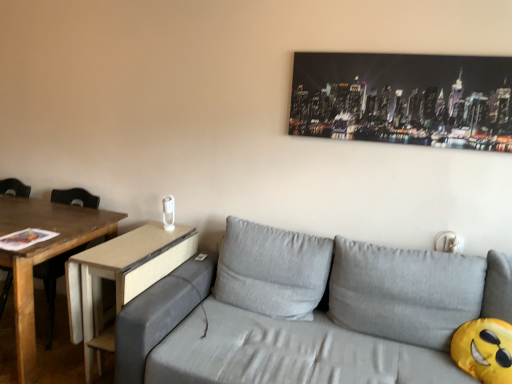
Image resolution: width=512 pixels, height=384 pixels. What do you see at coordinates (53, 283) in the screenshot?
I see `wooden chair at left` at bounding box center [53, 283].

What do you see at coordinates (308, 312) in the screenshot? I see `gray fabric couch at center` at bounding box center [308, 312].

This screenshot has width=512, height=384. What do you see at coordinates (120, 279) in the screenshot?
I see `light brown wood side table at center-left` at bounding box center [120, 279].

This screenshot has height=384, width=512. What do you see at coordinates (404, 99) in the screenshot?
I see `metallic cityscape print at upper right` at bounding box center [404, 99].

I want to click on wooden chair at left, so click(53, 283).

Between gray fabric couch at center and light brown wood side table at center-left, which one has less height?

light brown wood side table at center-left is shorter.

Considering the points (405, 272) and (130, 299), which point is in front, point (405, 272) or point (130, 299)?

Positioned in front is point (405, 272).

Considering the relative sizes of gray fabric couch at center and light brown wood side table at center-left in the image provided, is gray fabric couch at center smaller than light brown wood side table at center-left?

No, gray fabric couch at center is not smaller than light brown wood side table at center-left.

From the image's perspective, is wooden chair at left beneath light brown wood side table at center-left?

No.

Between wooden chair at left and light brown wood side table at center-left, which one has larger size?

With larger size is wooden chair at left.

Would you say wooden chair at left is outside light brown wood side table at center-left?

Yes, wooden chair at left is not within light brown wood side table at center-left.

Which is more to the right, wooden chair at left or light brown wood side table at center-left?

From the viewer's perspective, light brown wood side table at center-left appears more on the right side.

Which object is wider, metallic cityscape print at upper right or wooden chair at left?

wooden chair at left is wider.

Does point (340, 130) come farther from viewer compared to point (56, 192)?

That is False.

You are a GUI agent. You are given a task and a screenshot of the screen. Output one action in this format:
    pyautogui.click(x=<x>, y=<y>)
    Task: Click on the chair behind the metallic cityscape print at upper right
    
    Given the screenshot: What is the action you would take?
    pyautogui.click(x=53, y=283)

Would you say metallic cityscape print at upper right is to the left or to the right of wooden chair at left in the picture?

metallic cityscape print at upper right is positioned on wooden chair at left's right side.

Between light brown wood side table at center-left and wooden chair at left, which one appears on the left side from the viewer's perspective?

From the viewer's perspective, wooden chair at left appears more on the left side.

How far apart are light brown wood side table at center-left and wooden chair at left?

light brown wood side table at center-left and wooden chair at left are 16.36 inches apart.

Which is farther, (122, 241) or (75, 196)?

The point (75, 196) is farther from the camera.

From the image's perspective, who appears lower, light brown wood side table at center-left or wooden chair at left?

light brown wood side table at center-left.

This screenshot has width=512, height=384. Identify the location of picture frame that appears above the light brown wood side table at center-left (from the image's perspective). (404, 99).

Considering the sizes of objects metallic cityscape print at upper right and light brown wood side table at center-left in the image provided, who is taller, metallic cityscape print at upper right or light brown wood side table at center-left?

With more height is light brown wood side table at center-left.

Is metallic cityscape print at upper right spatially inside light brown wood side table at center-left, or outside of it?

metallic cityscape print at upper right lies outside light brown wood side table at center-left.

Considering the relative positions of metallic cityscape print at upper right and light brown wood side table at center-left in the image provided, is metallic cityscape print at upper right behind light brown wood side table at center-left?

That is True.

Are wooden chair at left and gray fabric couch at center located far from each other?

That's right, there is a large distance between wooden chair at left and gray fabric couch at center.

Is point (56, 257) farther from viewer compared to point (200, 366)?

Yes, it is.

How different are the orientations of wooden chair at left and gray fabric couch at center in degrees?

wooden chair at left and gray fabric couch at center are facing 2.31 degrees away from each other.

Does wooden chair at left have a larger size compared to gray fabric couch at center?

Actually, wooden chair at left might be smaller than gray fabric couch at center.

Is wooden chair at left not close to metallic cityscape print at upper right?

wooden chair at left is positioned a significant distance from metallic cityscape print at upper right.

Considering the sizes of objects wooden chair at left and metallic cityscape print at upper right in the image provided, who is wider, wooden chair at left or metallic cityscape print at upper right?

wooden chair at left.

Is point (5, 281) in front of point (445, 103)?

No, (5, 281) is further to viewer.

Can you tell me how much wooden chair at left and metallic cityscape print at upper right differ in facing direction?

There is a 1.16-degree angle between the facing directions of wooden chair at left and metallic cityscape print at upper right.

Locate an element on the screen. Image resolution: width=512 pixels, height=384 pixels. studio couch above the light brown wood side table at center-left (from a real-world perspective) is located at coordinates (308, 312).

Locate an element on the screen. The width and height of the screenshot is (512, 384). chair on the left of light brown wood side table at center-left is located at coordinates (53, 283).

Which object lies nearer to the anchor point wooden chair at left, metallic cityscape print at upper right or gray fabric couch at center?

gray fabric couch at center.

When comparing their distances from gray fabric couch at center, does light brown wood side table at center-left or wooden chair at left seem closer?

light brown wood side table at center-left is positioned closer to the anchor gray fabric couch at center.

When comparing their distances from gray fabric couch at center, does wooden chair at left or metallic cityscape print at upper right seem closer?

Among the two, metallic cityscape print at upper right is located nearer to gray fabric couch at center.

When comparing their distances from metallic cityscape print at upper right, does gray fabric couch at center or wooden chair at left seem closer?

gray fabric couch at center is closer to metallic cityscape print at upper right.

Looking at the image, which one is located closer to gray fabric couch at center, metallic cityscape print at upper right or wooden chair at left?

Based on the image, metallic cityscape print at upper right appears to be nearer to gray fabric couch at center.

Based on their spatial positions, is metallic cityscape print at upper right or light brown wood side table at center-left further from wooden chair at left?

metallic cityscape print at upper right is further to wooden chair at left.

Considering their positions, is light brown wood side table at center-left positioned further to wooden chair at left than metallic cityscape print at upper right?

metallic cityscape print at upper right is positioned further to the anchor wooden chair at left.

From the image, which object appears to be nearer to light brown wood side table at center-left, wooden chair at left or metallic cityscape print at upper right?

Among the two, wooden chair at left is located nearer to light brown wood side table at center-left.

The height and width of the screenshot is (384, 512). Find the location of `table located between gray fabric couch at center and metallic cityscape print at upper right in the depth direction`. table located between gray fabric couch at center and metallic cityscape print at upper right in the depth direction is located at coordinates (120, 279).

At what (x,y) coordinates should I click in order to perform the action: click on table between wooden chair at left and metallic cityscape print at upper right in the horizontal direction. Please return your answer as a coordinate pair (x, y). This screenshot has height=384, width=512. Looking at the image, I should click on (120, 279).

Locate an element on the screen. This screenshot has height=384, width=512. table between gray fabric couch at center and wooden chair at left along the z-axis is located at coordinates (x=120, y=279).

In order to click on studio couch situated between wooden chair at left and metallic cityscape print at upper right from left to right in this screenshot , I will do [308, 312].